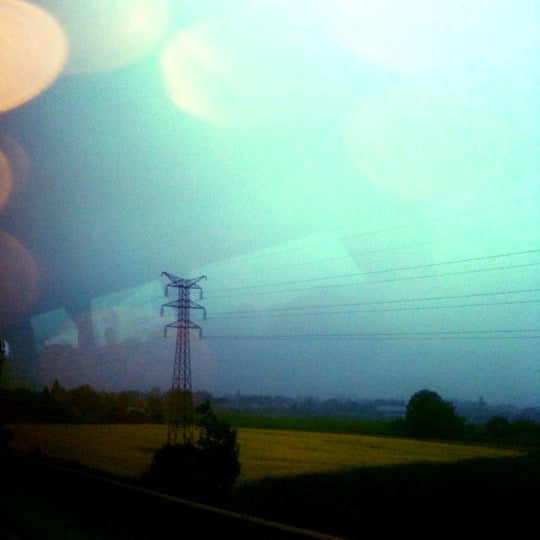
You are a GUI agent. You are given a task and a screenshot of the screen. Output one action in this format:
    pyautogui.click(x=<x>, y=<y>)
    Task: Click on the light
    
    Given the screenshot: What is the action you would take?
    pyautogui.click(x=13, y=94), pyautogui.click(x=172, y=70), pyautogui.click(x=82, y=73), pyautogui.click(x=20, y=158)